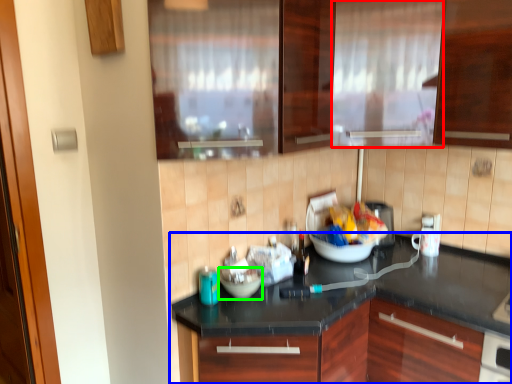
Question: Estimate the real-world distances between objects in this image. Which object is closer to curtain (highlighted by a red box), countertop (highlighted by a blue box) or bowl (highlighted by a green box)?

Choices:
 (A) countertop
 (B) bowl

Answer: (A)